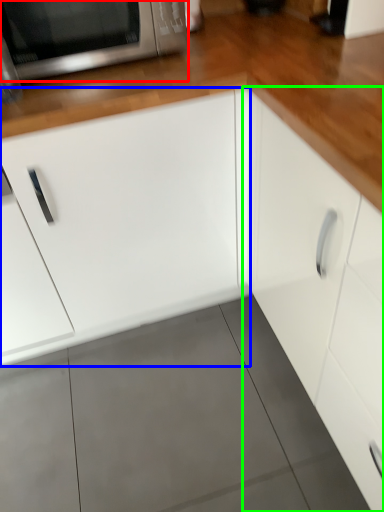
Question: Which object is the farthest from microwave oven (highlighted by a red box)? Choose among these: cabinetry (highlighted by a blue box) or cabinetry (highlighted by a green box).

Choices:
 (A) cabinetry
 (B) cabinetry

Answer: (B)